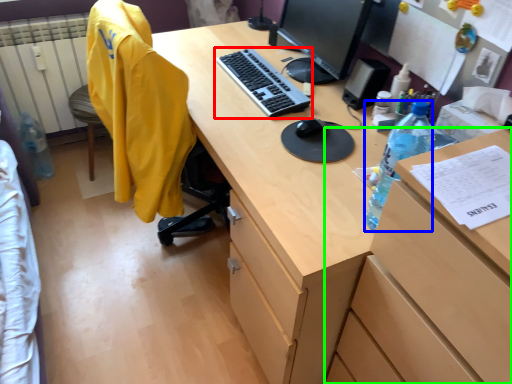
Question: Which object is positioned farthest from computer keyboard (highlighted by a red box)? Select from bottle (highlighted by a blue box) and file cabinet (highlighted by a green box).

Choices:
 (A) bottle
 (B) file cabinet

Answer: (B)